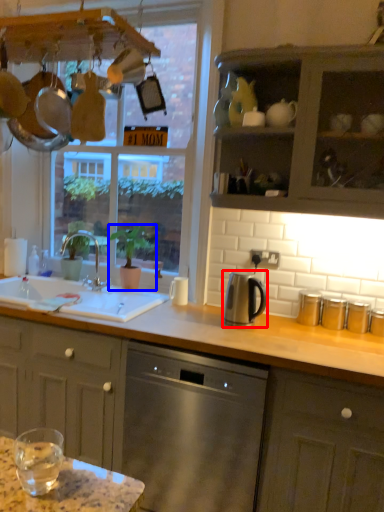
Question: Among these objects, which one is farthest to the camera, kitchen appliance (highlighted by a red box) or houseplant (highlighted by a blue box)?

Choices:
 (A) kitchen appliance
 (B) houseplant

Answer: (B)